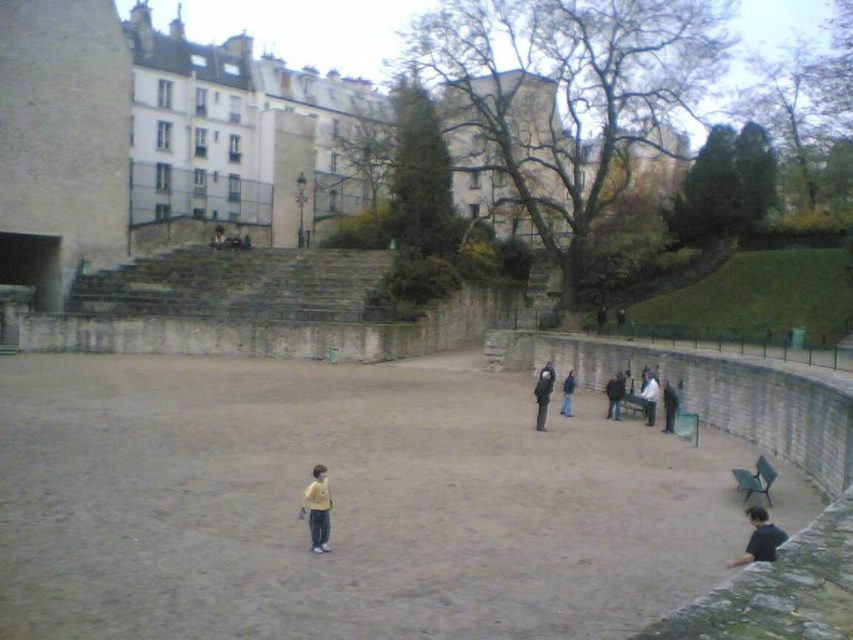
Question: Does yellow matte shirt at lower center have a greater width compared to dark blue jacket at center?

Choices:
 (A) yes
 (B) no

Answer: (B)

Question: Is yellow matte shirt at lower center bigger than dark gray fabric jacket at center right?

Choices:
 (A) yes
 (B) no

Answer: (B)

Question: Which of these objects is positioned closest to the dark blue jeans at lower right?

Choices:
 (A) dark gray fabric jacket at center right
 (B) white fabric jacket at center-right
 (C) dark blue jacket at center right
 (D) yellow matte shirt at lower center

Answer: (B)

Question: Based on their relative distances, which object is nearer to the dark gray fabric jacket at center right?

Choices:
 (A) dark blue shirt at lower right
 (B) white fabric jacket at center-right

Answer: (B)

Question: Which of the following is the closest to the observer?

Choices:
 (A) dark blue jacket at center
 (B) white fabric jacket at center-right
 (C) dark blue jacket at center right

Answer: (B)

Question: Is yellow matte shirt at lower center to the right of dark blue jacket at center right from the viewer's perspective?

Choices:
 (A) yes
 (B) no

Answer: (B)